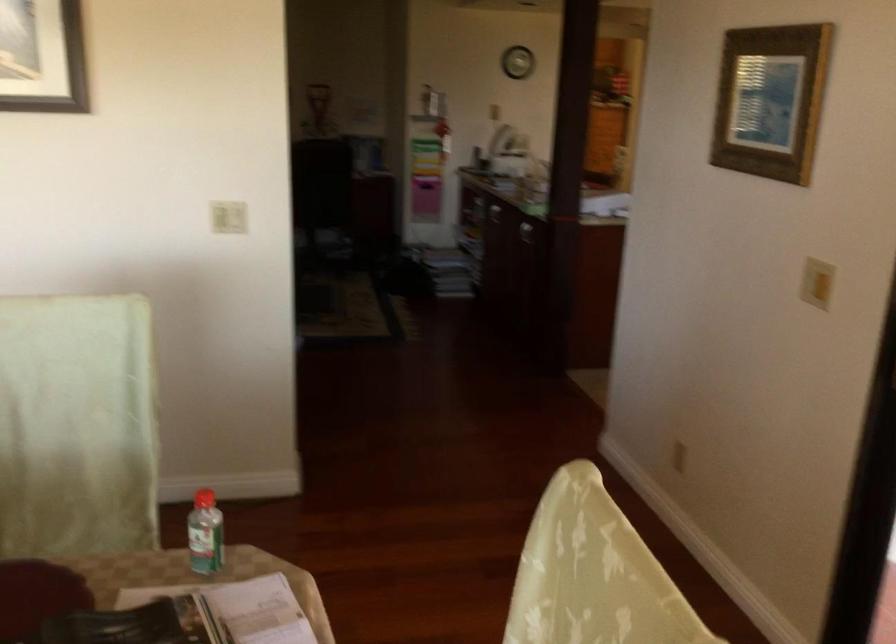
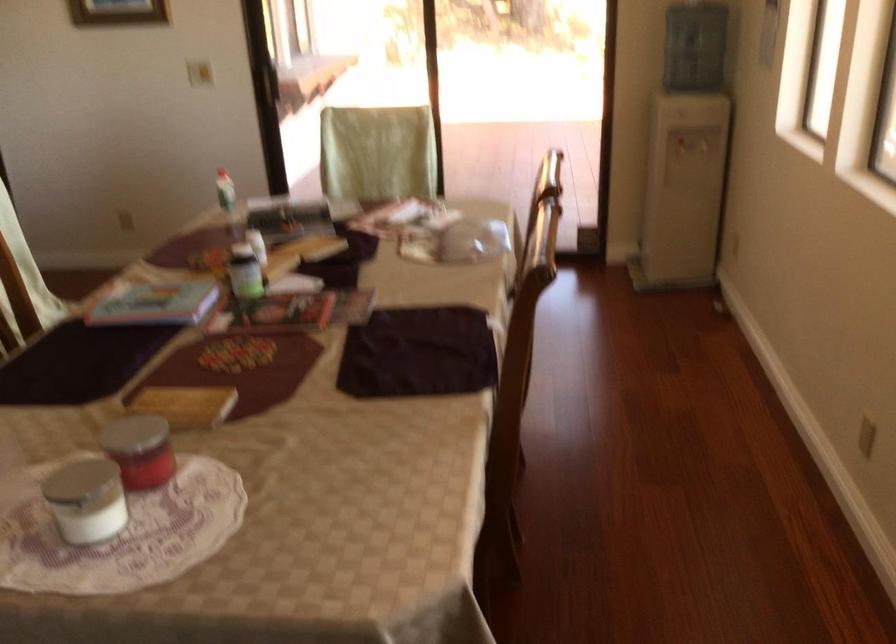
In the second image, find the point that corresponds to (197,545) in the first image.

(225, 190)